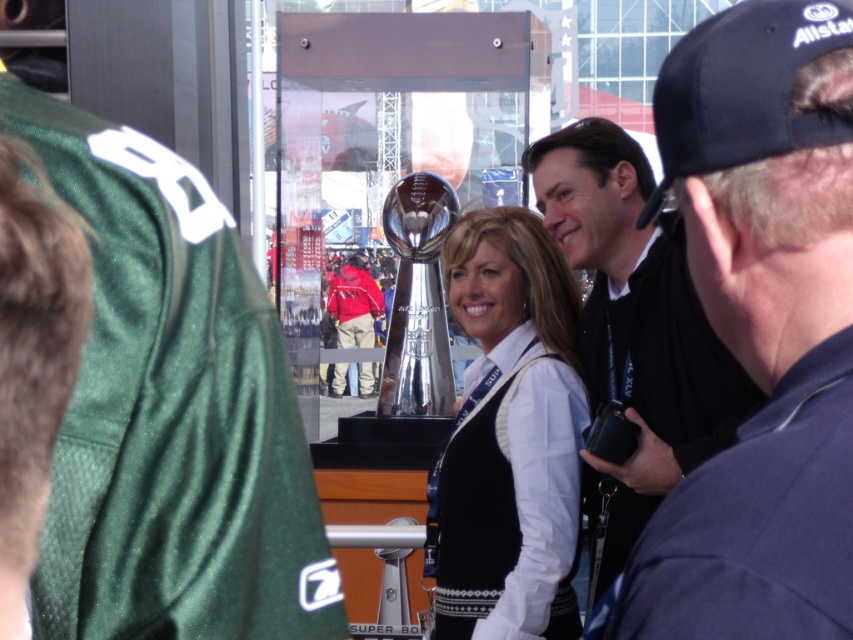
You are an event organizer who needs to ensure that the black matte jacket at center and the black fabric baseball cap at upper right can both fit into a storage box. The box has a height limit of 30 cm. Can you confirm if both items will fit based on their sizes?

The black matte jacket at center has a smaller size compared to black fabric baseball cap at upper right. However, without specific measurements for each item, it is impossible to determine if both will fit within the 30 cm height limit. Additional information about their individual dimensions is required.

You are at the event and want to take a photo of the trophy in the center. There are two points marked in the image. If you stand at point (563, 548) and point (705, 337), which point will give you a clearer view of the trophy without obstruction?

Standing at point (705, 337) will give a clearer view of the trophy because point (563, 548) is behind it, meaning the trophy might be obstructed from that position.

You are a photographer standing at the center of the scene. You want to take a photo of the dark blue cap at upper right. Based on its 2D coordinates, where should you aim your camera relative to the center of the image?

The dark blue cap at upper right is located at coordinates 0.516 on the x axis and 0.893 on the y axis. Since both values are greater than 0.5, it is positioned to the right and above the center of the image. To capture it, aim your camera slightly to the right and upwards from the center.